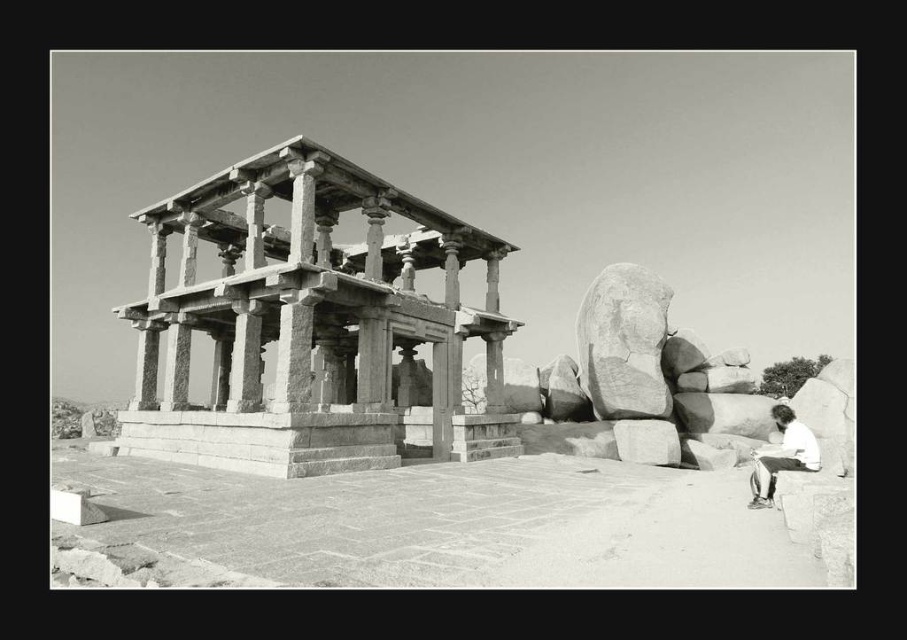
Is stone carved pavilion at center to the right of smooth gray rock at center from the viewer's perspective?

No, stone carved pavilion at center is not to the right of smooth gray rock at center.

Between point (366, 266) and point (623, 390), which one is positioned in front?

Point (366, 266) is more forward.

This screenshot has height=640, width=907. What do you see at coordinates (310, 323) in the screenshot? I see `stone carved pavilion at center` at bounding box center [310, 323].

Where is `stone carved pavilion at center`? stone carved pavilion at center is located at coordinates coord(310,323).

Can you confirm if smooth gray rock at center is positioned above white cotton shirt at lower right?

Correct, smooth gray rock at center is located above white cotton shirt at lower right.

Consider the image. Does smooth gray rock at center appear on the right side of white cotton shirt at lower right?

Incorrect, smooth gray rock at center is not on the right side of white cotton shirt at lower right.

Describe the element at coordinates (623, 342) in the screenshot. Image resolution: width=907 pixels, height=640 pixels. I see `smooth gray rock at center` at that location.

Identify the location of smooth gray rock at center. The image size is (907, 640). (623, 342).

Is stone carved pavilion at center bigger than white cotton shirt at lower right?

Indeed, stone carved pavilion at center has a larger size compared to white cotton shirt at lower right.

Looking at this image, who is higher up, stone carved pavilion at center or white cotton shirt at lower right?

Positioned higher is stone carved pavilion at center.

Who is more distant from viewer, (387, 419) or (781, 465)?

Point (387, 419)

The height and width of the screenshot is (640, 907). Find the location of `stone carved pavilion at center`. stone carved pavilion at center is located at coordinates (310, 323).